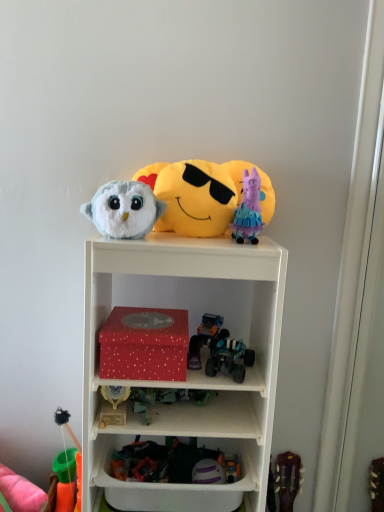
Find the location of `free space above red matte box at center (from a real-world perspective)`. free space above red matte box at center (from a real-world perspective) is located at coordinates (149, 318).